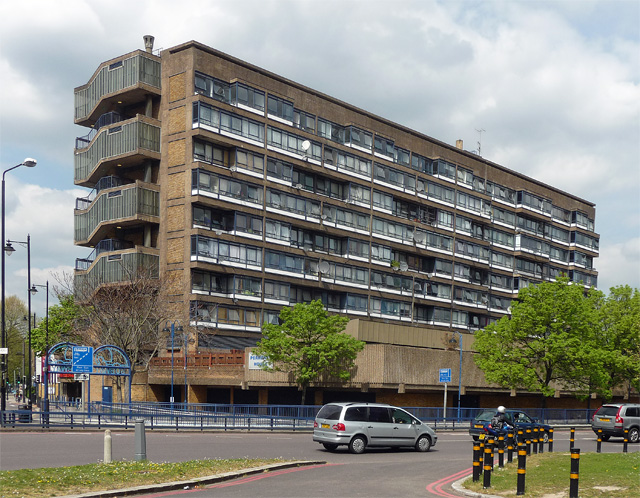
Locate an element on the screen. dark blue archway is located at coordinates (112, 345), (56, 344).